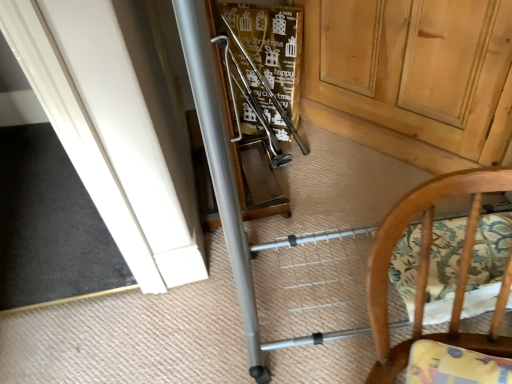
Where is `wooden door at center`? The height and width of the screenshot is (384, 512). wooden door at center is located at coordinates (416, 68).

Describe the element at coordinates (416, 68) in the screenshot. The height and width of the screenshot is (384, 512). I see `wooden door at center` at that location.

You are a GUI agent. You are given a task and a screenshot of the screen. Output one action in this format:
    pyautogui.click(x=<x>, y=<y>)
    Task: Click on the wooden chair at lower right
    This screenshot has width=512, height=384.
    Given the screenshot: What is the action you would take?
    coord(426,268)

The image size is (512, 384). What do you see at coordinates (426, 268) in the screenshot?
I see `wooden chair at lower right` at bounding box center [426, 268].

Find the location of `wooden door at center`. wooden door at center is located at coordinates (416, 68).

Based on their positions, is wooden chair at lower right located to the left or right of wooden door at center?

Clearly, wooden chair at lower right is on the left of wooden door at center in the image.

Who is more distant, wooden chair at lower right or wooden door at center?

wooden door at center is behind.

Is point (374, 300) farther from camera compared to point (374, 4)?

No.

From the image's perspective, between wooden chair at lower right and wooden door at center, who is located below?

wooden chair at lower right appears lower in the image.

From a real-world perspective, between wooden chair at lower right and wooden door at center, who is vertically lower?

wooden door at center.

Between wooden chair at lower right and wooden door at center, which one has smaller width?

Thinner between the two is wooden chair at lower right.

In the scene shown: Is wooden chair at lower right taller than wooden door at center?

Incorrect, the height of wooden chair at lower right is not larger of that of wooden door at center.

Is wooden chair at lower right smaller than wooden door at center?

Yes.

Would you say wooden door at center is part of wooden chair at lower right's contents?

No.

Consider the image. Is wooden chair at lower right far away from wooden door at center?

wooden chair at lower right is near wooden door at center, not far away.

Could you tell me if wooden chair at lower right is turned towards wooden door at center?

No.

How many degrees apart are the facing directions of wooden chair at lower right and wooden door at center?

wooden chair at lower right and wooden door at center are facing 30.7 degrees away from each other.

Looking at this image, how distant is wooden chair at lower right from wooden door at center?

wooden chair at lower right is 18.13 inches away from wooden door at center.

The image size is (512, 384). In order to click on chair lying in front of the wooden door at center in this screenshot , I will do `click(426, 268)`.

Which object is positioned more to the right, wooden door at center or wooden chair at lower right?

From the viewer's perspective, wooden door at center appears more on the right side.

Is wooden door at center in front of or behind wooden chair at lower right in the image?

Clearly, wooden door at center is behind wooden chair at lower right.

Which point is more distant from viewer, [412,44] or [454,344]?

The point [412,44] is more distant.

Based on the photo, from the image's perspective, is wooden door at center on top of wooden chair at lower right?

Yes, from the image's perspective, wooden door at center is over wooden chair at lower right.

From a real-world perspective, relative to wooden chair at lower right, is wooden door at center vertically above or below?

Clearly, from a real-world perspective, wooden door at center is below wooden chair at lower right.

Looking at their sizes, would you say wooden door at center is wider or thinner than wooden chair at lower right?

Considering their sizes, wooden door at center looks broader than wooden chair at lower right.

Does wooden door at center have a lesser height compared to wooden chair at lower right?

No, wooden door at center is not shorter than wooden chair at lower right.

In terms of size, does wooden door at center appear bigger or smaller than wooden chair at lower right?

Clearly, wooden door at center is larger in size than wooden chair at lower right.

Do you think wooden door at center is within wooden chair at lower right, or outside of it?

wooden door at center exists outside the volume of wooden chair at lower right.

Can you see wooden door at center touching wooden chair at lower right?

No, wooden door at center is not in contact with wooden chair at lower right.

In the scene shown: Is wooden door at center oriented away from wooden chair at lower right?

No.

How many degrees apart are the facing directions of wooden door at center and wooden chair at lower right?

The angular difference between wooden door at center and wooden chair at lower right is 30.7 degrees.

Measure the distance between wooden door at center and wooden chair at lower right.

A distance of 18.13 inches exists between wooden door at center and wooden chair at lower right.

Locate an element on the screen. chair above the wooden door at center (from a real-world perspective) is located at coordinates (426, 268).

Find the location of `door beneath the wooden chair at lower right (from a real-world perspective)`. door beneath the wooden chair at lower right (from a real-world perspective) is located at coordinates (416, 68).

I want to click on chair on the left of wooden door at center, so click(426, 268).